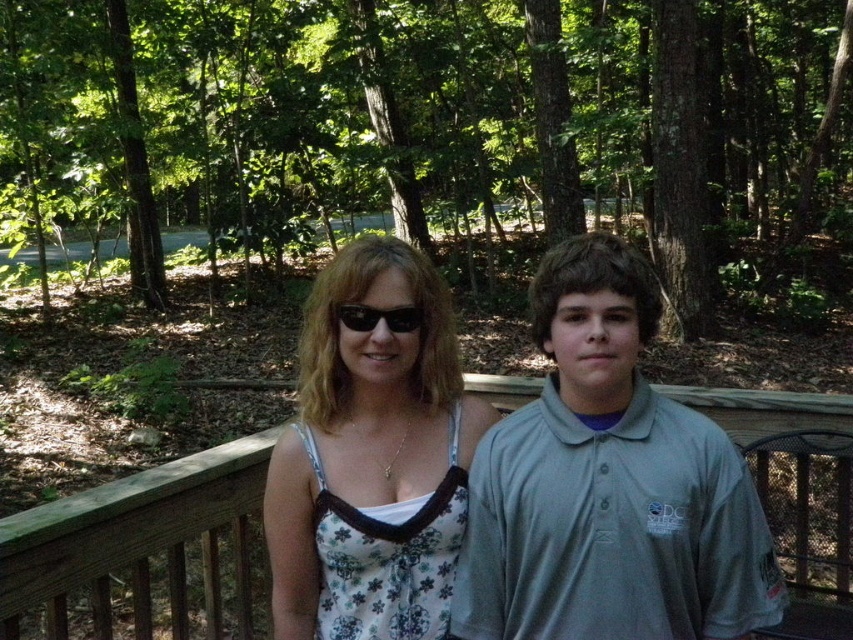
Question: Does gray cotton polo shirt at center appear under white floral dress at center?

Choices:
 (A) no
 (B) yes

Answer: (A)

Question: Which point appears farthest from the camera in this image?

Choices:
 (A) (346, 593)
 (B) (399, 324)

Answer: (A)

Question: Which point is farther to the camera?

Choices:
 (A) gray cotton polo shirt at center
 (B) white floral dress at center
 (C) black plastic sunglasses at center

Answer: (C)

Question: Which point is farther to the camera?

Choices:
 (A) click(x=393, y=321)
 (B) click(x=651, y=308)

Answer: (A)

Question: Is white floral dress at center thinner than black plastic sunglasses at center?

Choices:
 (A) yes
 (B) no

Answer: (B)

Question: Is gray cotton polo shirt at center positioned before black plastic sunglasses at center?

Choices:
 (A) no
 (B) yes

Answer: (B)